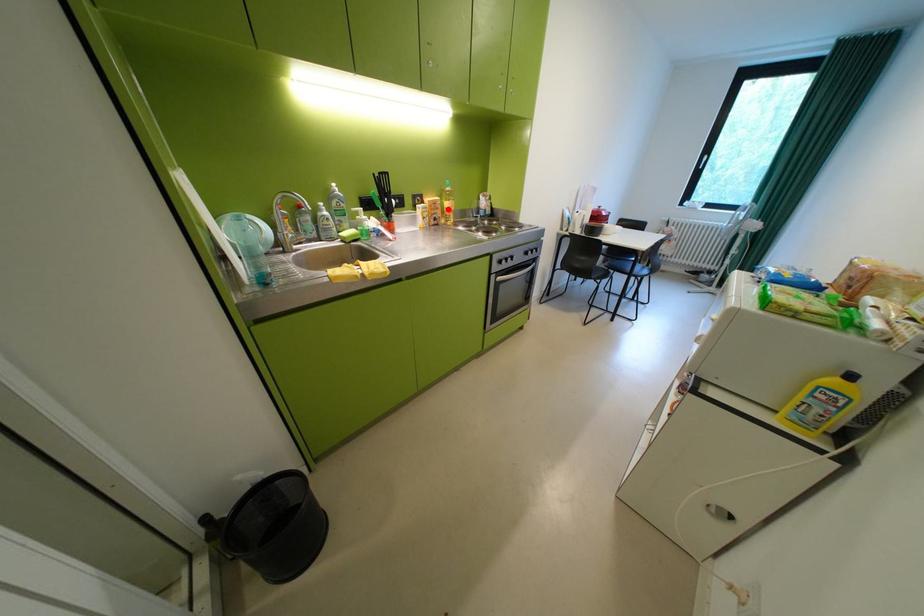
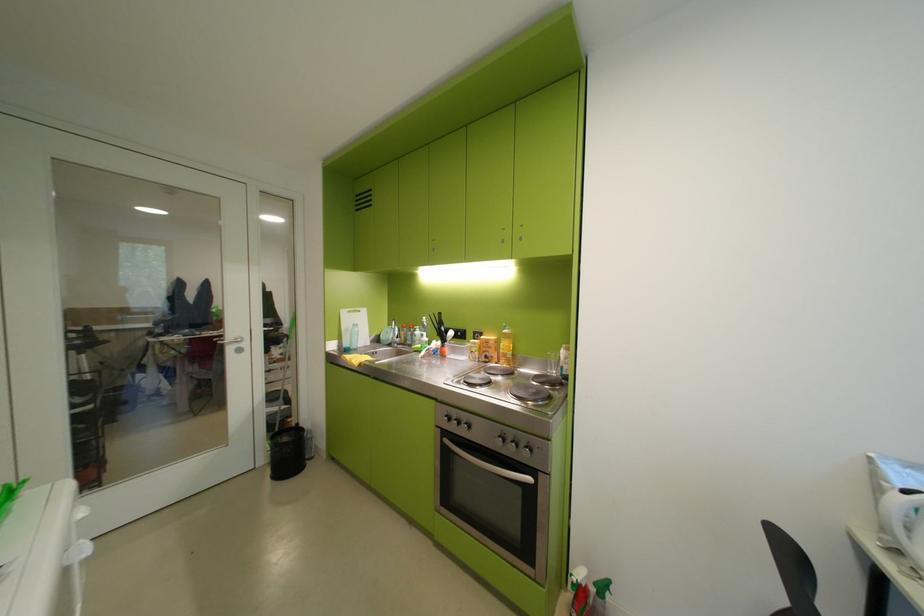
Question: I am providing you with two images of the same scene from different viewpoints. A red point is marked on the first image. At the location where the point appears in image 1, is it still visible in image 2?

Choices:
 (A) Yes
 (B) No

Answer: (A)